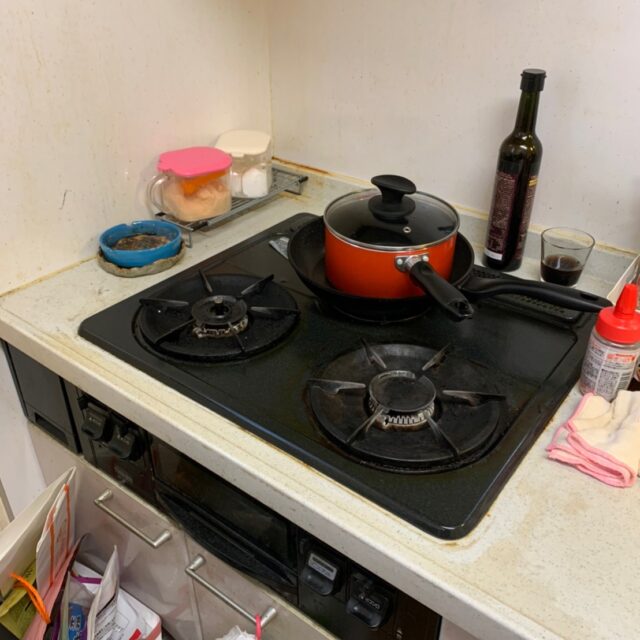
At what (x,y) coordinates should I click in order to perform the action: click on burners. Please return your answer as a coordinate pair (x, y). The width and height of the screenshot is (640, 640). Looking at the image, I should click on (228, 324), (413, 406).